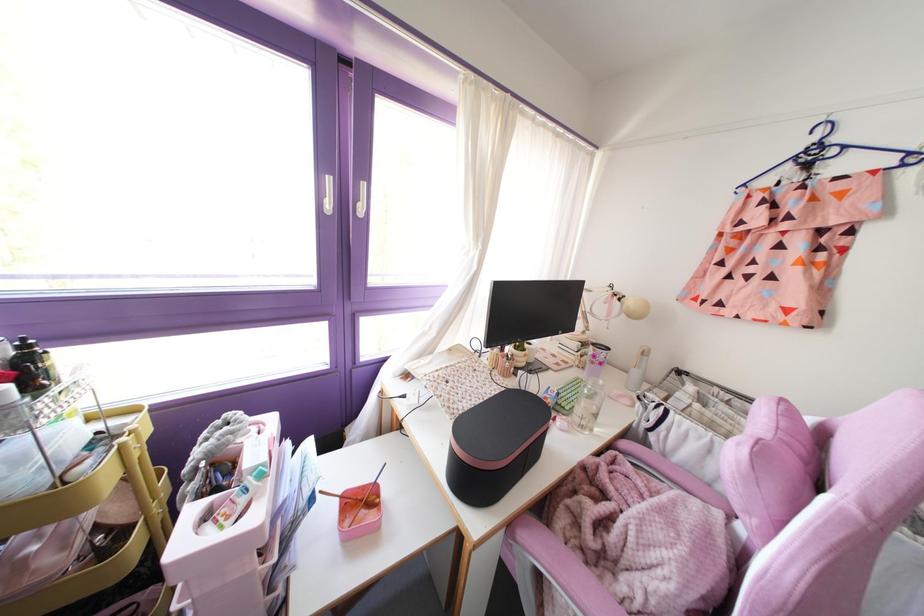
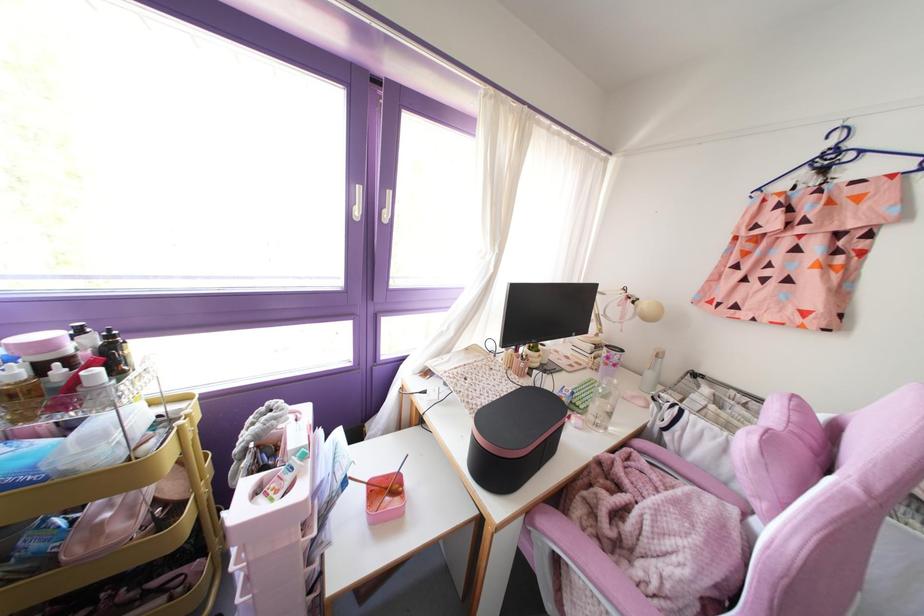
Where in the second image is the point corresponding to (x=32, y=389) from the first image?

(116, 373)